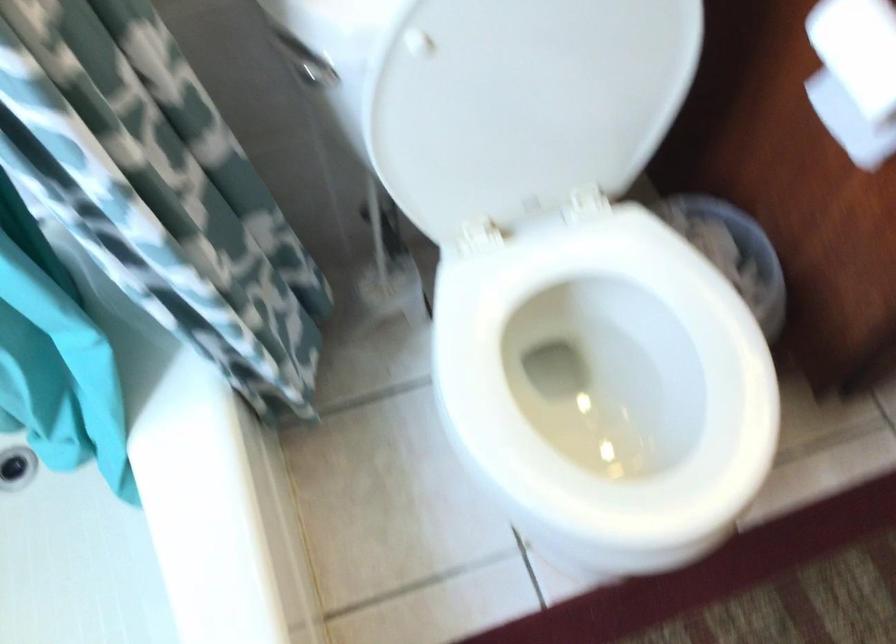
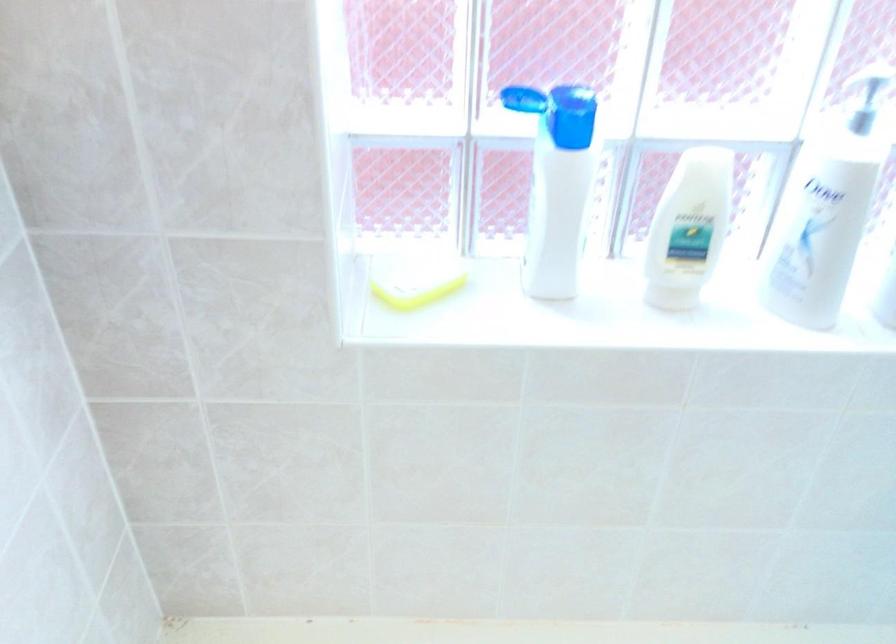
How did the camera likely rotate?

The camera's rotation is toward left-down.